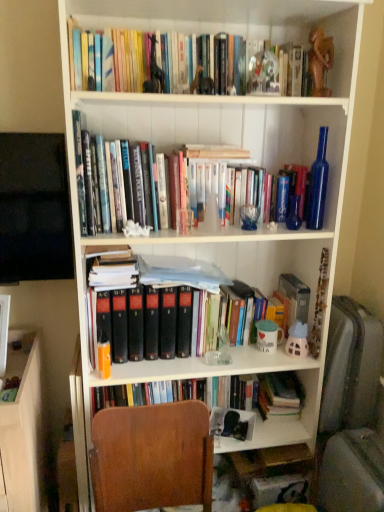
Question: Is hardcover books at upper center, acting as the first book starting from the front, not close to hardcover book at center?

Choices:
 (A) yes
 (B) no

Answer: (B)

Question: Is hardcover books at upper center, which is counted as the 2th book, starting from the bottom, further to the viewer compared to hardcover book at center?

Choices:
 (A) no
 (B) yes

Answer: (A)

Question: Does hardcover books at upper center, which ranks as the 2th book in back-to-front order, have a greater height compared to hardcover book at center?

Choices:
 (A) no
 (B) yes

Answer: (A)

Question: From the image's perspective, is hardcover books at upper center, acting as the first book starting from the front, on hardcover book at center?

Choices:
 (A) no
 (B) yes

Answer: (B)

Question: Is hardcover books at upper center, which is counted as the 2th book, starting from the bottom, smaller than hardcover book at center?

Choices:
 (A) no
 (B) yes

Answer: (A)

Question: Based on their sizes in the image, would you say white glossy mug at middle right is bigger or smaller than brown wood chair at lower center?

Choices:
 (A) big
 (B) small

Answer: (B)

Question: Visually, is white glossy mug at middle right positioned to the left or to the right of brown wood chair at lower center?

Choices:
 (A) left
 (B) right

Answer: (B)

Question: From a real-world perspective, is white glossy mug at middle right above or below brown wood chair at lower center?

Choices:
 (A) above
 (B) below

Answer: (A)

Question: In terms of height, does white glossy mug at middle right look taller or shorter compared to brown wood chair at lower center?

Choices:
 (A) tall
 (B) short

Answer: (B)

Question: Is hardcover books at upper center, acting as the first book starting from the front, spatially inside white glossy mug at middle right, or outside of it?

Choices:
 (A) inside
 (B) outside

Answer: (B)

Question: From their relative heights in the image, would you say hardcover books at upper center, placed as the first book when sorted from top to bottom, is taller or shorter than white glossy mug at middle right?

Choices:
 (A) short
 (B) tall

Answer: (B)

Question: Looking at their shapes, would you say hardcover books at upper center, acting as the first book starting from the front, is wider or thinner than white glossy mug at middle right?

Choices:
 (A) wide
 (B) thin

Answer: (A)

Question: In the image, is hardcover books at upper center, acting as the first book starting from the front, positioned in front of or behind white glossy mug at middle right?

Choices:
 (A) behind
 (B) front

Answer: (B)

Question: Based on their positions, is brown wood chair at lower center located to the left or right of hardcover books at upper center, acting as the first book starting from the front?

Choices:
 (A) left
 (B) right

Answer: (A)

Question: From the image's perspective, is brown wood chair at lower center located above or below hardcover books at upper center, which ranks as the 2th book in back-to-front order?

Choices:
 (A) above
 (B) below

Answer: (B)